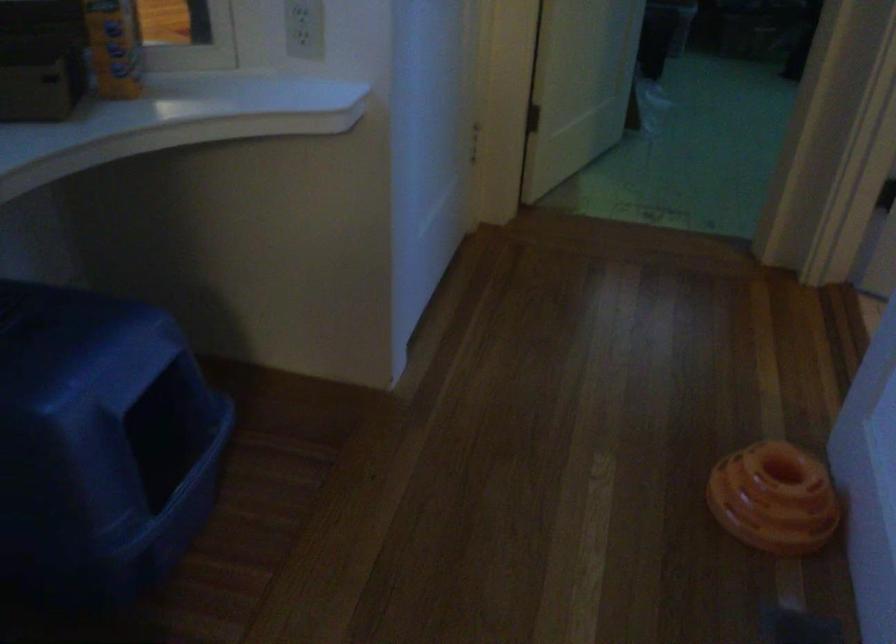
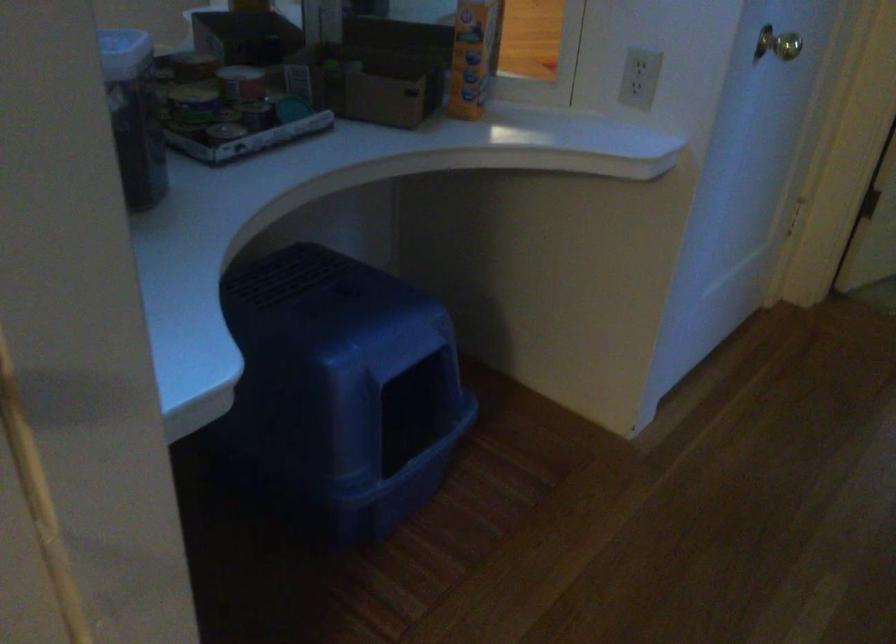
In the second image, find the point that corresponds to (x=85, y=438) in the first image.

(341, 388)